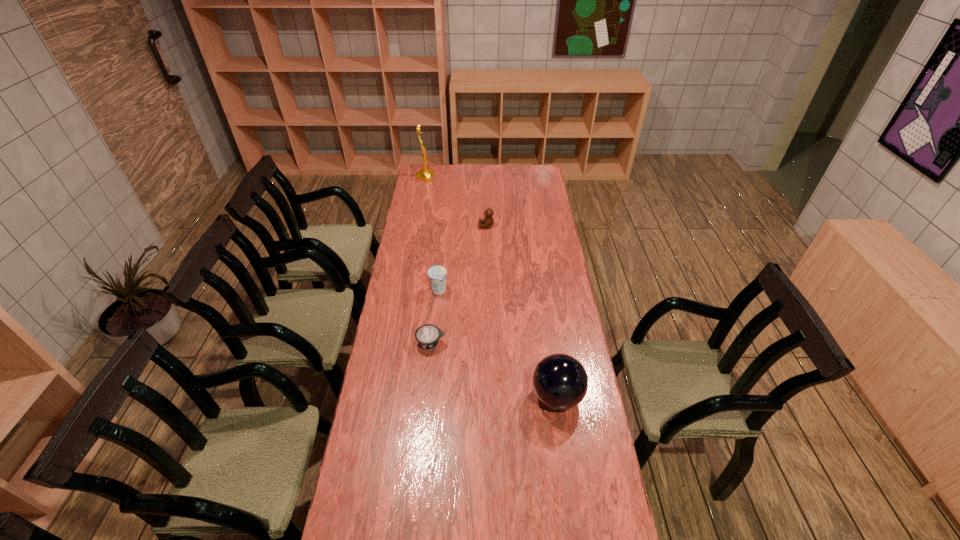
I want to click on the farthest object, so click(426, 174).

Locate an element on the screen. The image size is (960, 540). the tallest object is located at coordinates [426, 174].

Find the location of a particular element. the rightmost object is located at coordinates (560, 381).

The height and width of the screenshot is (540, 960). Identify the location of the second tallest object. (560, 381).

Where is `the second object from right to left`? the second object from right to left is located at coordinates (488, 221).

At what (x,y) coordinates should I click in order to perform the action: click on teddy bear. Please return your answer as a coordinate pair (x, y). This screenshot has height=540, width=960. Looking at the image, I should click on (488, 221).

Where is `the farther yogurt`? the farther yogurt is located at coordinates (437, 274).

Where is `the taller yogurt`? the taller yogurt is located at coordinates (437, 274).

Locate an element on the screen. The height and width of the screenshot is (540, 960). the second nearest object is located at coordinates (428, 335).

Identify the location of the shorter yogurt. This screenshot has width=960, height=540. (428, 335).